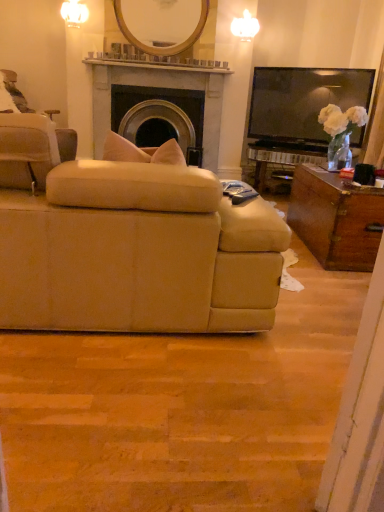
Question: From the image's perspective, relative to matte stone fireplace at center, is beige fabric chair at left above or below?

Choices:
 (A) below
 (B) above

Answer: (A)

Question: Is point pyautogui.click(x=8, y=169) closer or farther from the camera than point pyautogui.click(x=134, y=75)?

Choices:
 (A) farther
 (B) closer

Answer: (B)

Question: Which object is the closest to the beige fabric couch at center?

Choices:
 (A) beige fabric chair at left
 (B) matte stone fireplace at center
 (C) black plastic remote control at center
 (D) wooden/matte mirror at upper center

Answer: (C)

Question: Estimate the real-world distances between objects in this image. Which object is closer to the beige fabric chair at left?

Choices:
 (A) wooden/matte mirror at upper center
 (B) beige fabric couch at center
 (C) black plastic remote control at center
 (D) matte stone fireplace at center

Answer: (B)